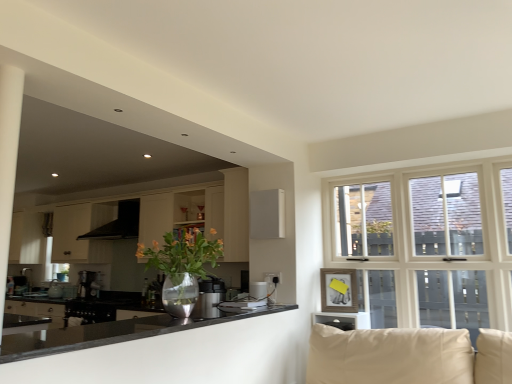
Question: Is the depth of metallic vase with flowers at center less than that of satin silver kettle at center?

Choices:
 (A) yes
 (B) no

Answer: (A)

Question: Can you confirm if metallic vase with flowers at center is smaller than satin silver kettle at center?

Choices:
 (A) no
 (B) yes

Answer: (A)

Question: From the image's perspective, is metallic vase with flowers at center below satin silver kettle at center?

Choices:
 (A) yes
 (B) no

Answer: (B)

Question: From a real-world perspective, is metallic vase with flowers at center positioned over satin silver kettle at center based on gravity?

Choices:
 (A) yes
 (B) no

Answer: (A)

Question: Is metallic vase with flowers at center at the right side of satin silver kettle at center?

Choices:
 (A) no
 (B) yes

Answer: (A)

Question: Is metallic vase with flowers at center shorter than satin silver kettle at center?

Choices:
 (A) no
 (B) yes

Answer: (A)

Question: Is satin silver kettle at center at the right side of black glossy countertop at lower left?

Choices:
 (A) yes
 (B) no

Answer: (A)

Question: Could black glossy countertop at lower left be considered to be inside satin silver kettle at center?

Choices:
 (A) no
 (B) yes

Answer: (A)

Question: Does satin silver kettle at center have a greater width compared to black glossy countertop at lower left?

Choices:
 (A) no
 (B) yes

Answer: (A)

Question: From the image's perspective, would you say satin silver kettle at center is positioned over black glossy countertop at lower left?

Choices:
 (A) yes
 (B) no

Answer: (B)

Question: Is satin silver kettle at center in contact with black glossy countertop at lower left?

Choices:
 (A) no
 (B) yes

Answer: (A)

Question: Is satin silver kettle at center bigger than black glossy countertop at lower left?

Choices:
 (A) yes
 (B) no

Answer: (B)

Question: Does black matte exhaust hood at upper left have a greater height compared to black glossy countertop at lower left?

Choices:
 (A) yes
 (B) no

Answer: (A)